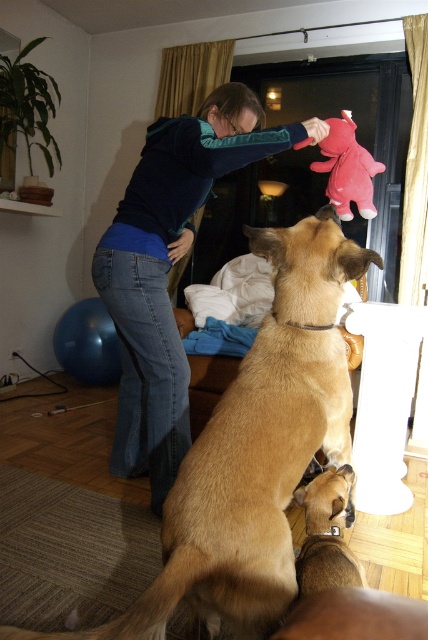
You are organizing a space for a new pet. You have a brown furry dog at center and a blue fleece sweater at upper center. Which item takes up more area in the room?

The blue fleece sweater at upper center takes up more area than the brown furry dog at center.

You are a guest in this home and want to greet the brown furry dog at center. The blue fleece sweater at upper center is hanging on a hook on the wall. To reach the dog, should you walk around the sweater to your left or right?

Since the brown furry dog at center is to the right of the blue fleece sweater at upper center, you should walk around the sweater to your left to reach the dog.